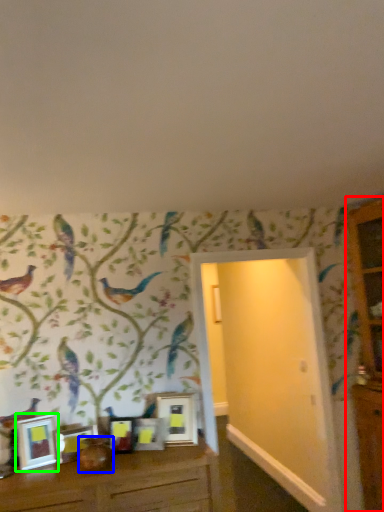
Question: Considering the real-world distances, which object is closest to dresser (highlighted by a red box)? vase (highlighted by a blue box) or picture frame (highlighted by a green box).

Choices:
 (A) vase
 (B) picture frame

Answer: (A)